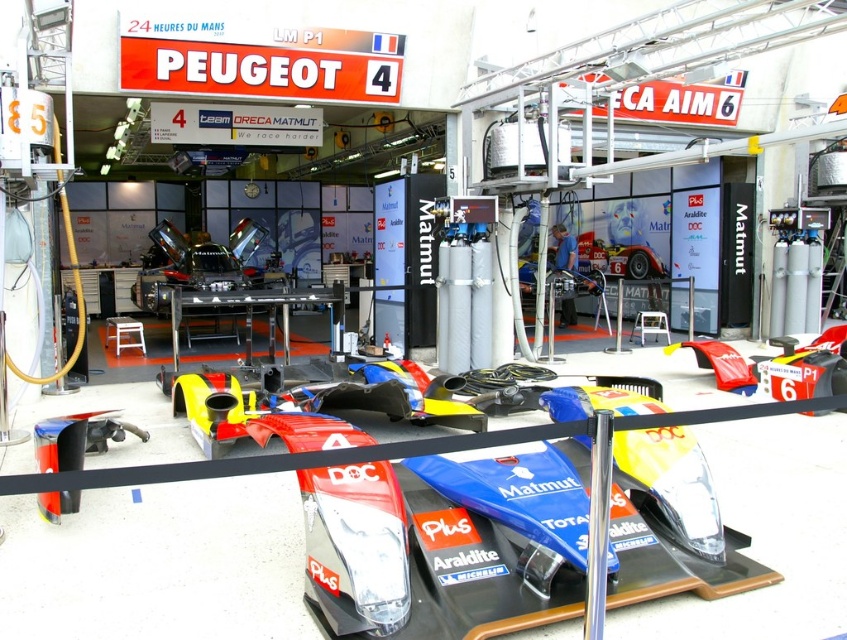
Question: Can you confirm if shiny blue carbon fiber race car at center is thinner than metallic silver mechanic at center?

Choices:
 (A) yes
 (B) no

Answer: (B)

Question: Where is shiny blue carbon fiber race car at center located in relation to silver metallic race car at center in the image?

Choices:
 (A) left
 (B) right

Answer: (B)

Question: Which object is closer to the camera taking this photo?

Choices:
 (A) metallic silver mechanic at center
 (B) shiny blue carbon fiber race car at center

Answer: (B)

Question: Among these points, which one is farthest from the camera?

Choices:
 (A) (449, 528)
 (B) (225, 276)

Answer: (B)

Question: Which object is closer to the camera taking this photo?

Choices:
 (A) metallic silver mechanic at center
 (B) shiny blue carbon fiber race car at center
 (C) silver metallic race car at center

Answer: (B)

Question: Is silver metallic race car at center above metallic silver mechanic at center?

Choices:
 (A) yes
 (B) no

Answer: (B)